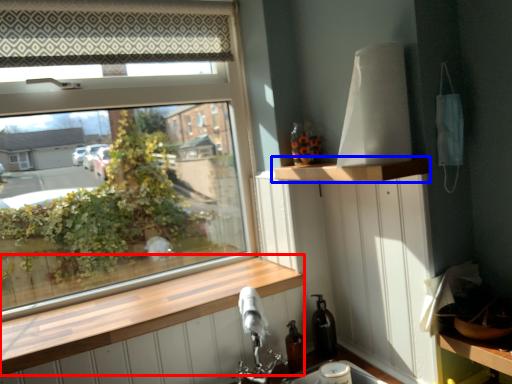
Question: Which object is further to the camera taking this photo, window sill (highlighted by a red box) or shelf (highlighted by a blue box)?

Choices:
 (A) window sill
 (B) shelf

Answer: (A)